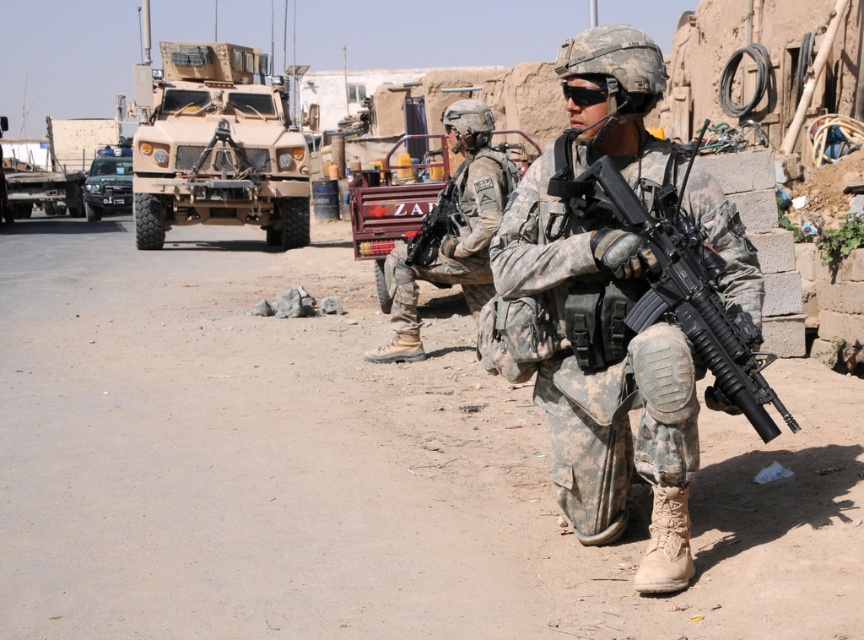
You are a drone operator observing the military scene. You notice two points marked as point (617, 193) and point (93, 164). Based on their positions, which point is closer to the soldiers in the foreground?

Point (617, 193) is in front of point (93, 164), so it is closer to the soldiers in the foreground.

You are a soldier in the desert. You need to reach the camouflage fabric uniform at center to retrieve your gear. However, there is a matte tan military vehicle at upper left in your path. Can you walk directly to the uniform without going around the vehicle?

The camouflage fabric uniform at center is behind the matte tan military vehicle at upper left, so you cannot walk directly to the uniform without going around the vehicle.

You are a soldier in the desert. You need to move from your current position to the matte tan military vehicle at upper left while avoiding the camouflage fabric uniform at center. Which direction should you move to reach the vehicle without passing through the uniform?

To reach the matte tan military vehicle at upper left without passing through the camouflage fabric uniform at center, you should move to the left since the matte tan military vehicle at upper left is positioned on the left side of the camouflage fabric uniform at center.